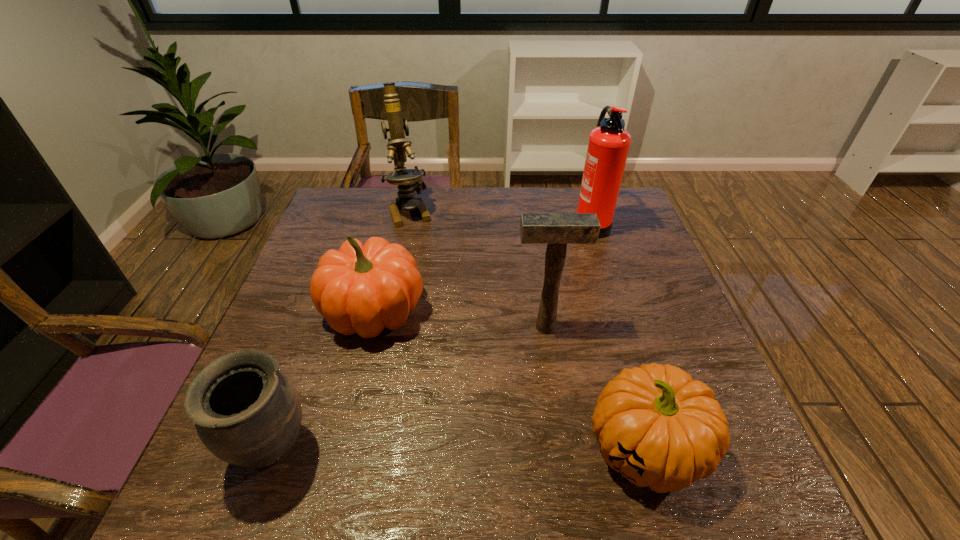
The width and height of the screenshot is (960, 540). Identify the location of urn present at the near edge. click(x=247, y=412).

I want to click on pumpkin positioned at the near edge, so click(659, 428).

Identify the location of pumpkin that is at the left edge. The width and height of the screenshot is (960, 540). (361, 289).

The height and width of the screenshot is (540, 960). I want to click on urn located at the left edge, so click(247, 412).

This screenshot has width=960, height=540. Find the location of `fire extinguisher that is positioned at the right edge`. fire extinguisher that is positioned at the right edge is located at coordinates (608, 146).

Identify the location of pumpkin present at the right edge. (659, 428).

I want to click on object at the near left corner, so click(x=247, y=412).

This screenshot has width=960, height=540. What are the coordinates of `object situated at the far right corner` in the screenshot? It's located at (608, 146).

Find the location of `object situated at the near right corner`. object situated at the near right corner is located at coordinates (659, 428).

At what (x,y) coordinates should I click in order to perform the action: click on free space at the far edge of the desktop. Please return your answer as a coordinate pair (x, y). Looking at the image, I should click on (466, 228).